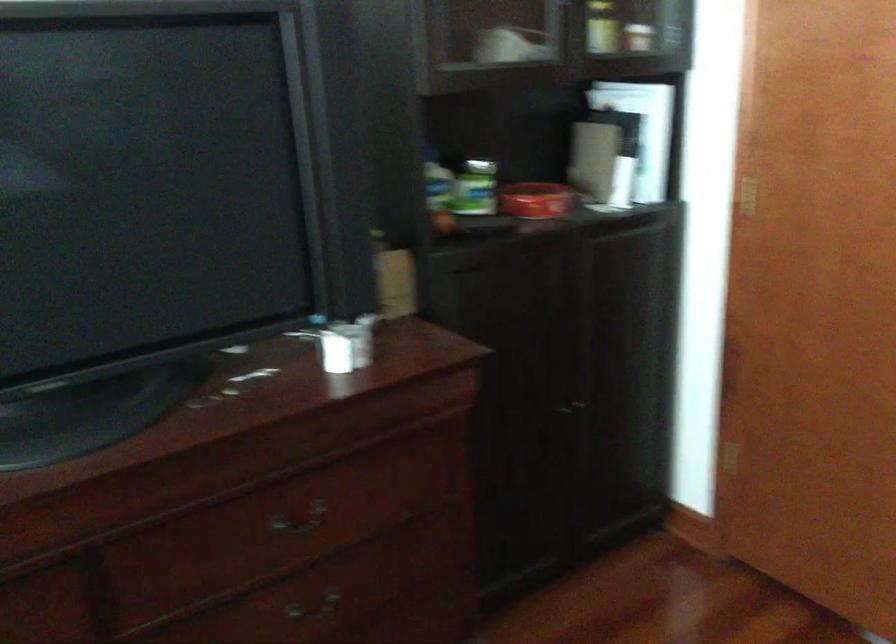
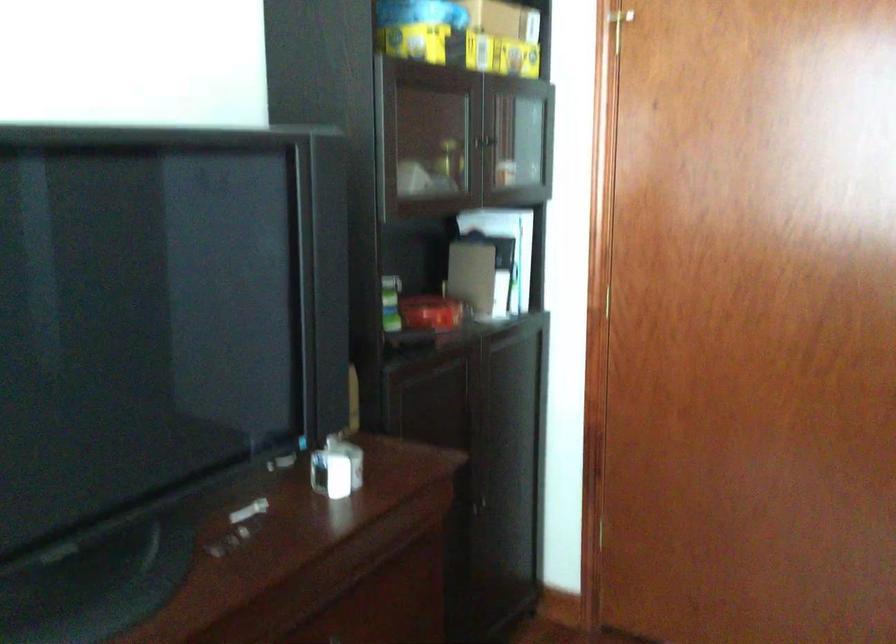
Question: The images are taken continuously from a first-person perspective. In which direction is your viewpoint rotating?

Choices:
 (A) Left
 (B) Right
 (C) Up
 (D) Down

Answer: (B)